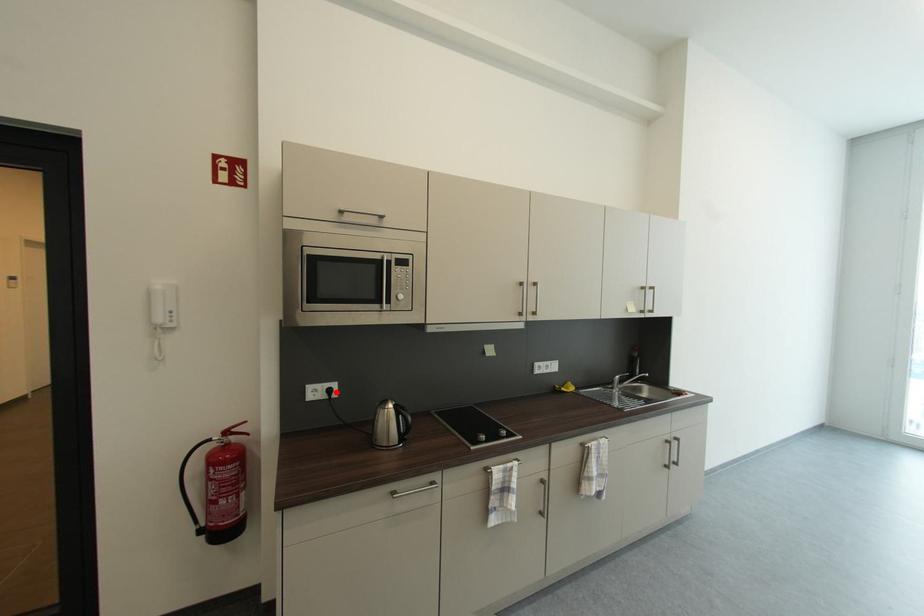
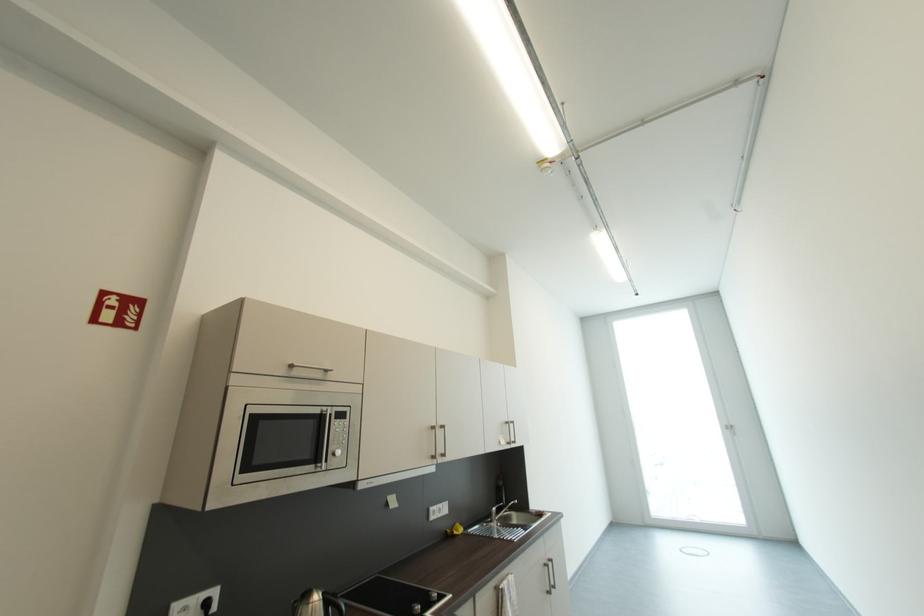
Find the pixel in the second image that matches the highlighted location in the first image.

(213, 605)